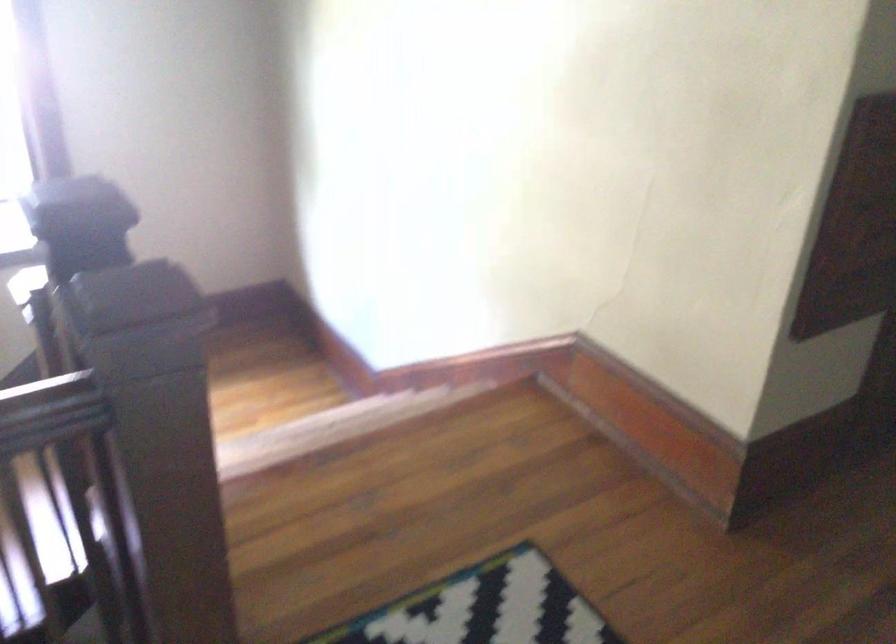
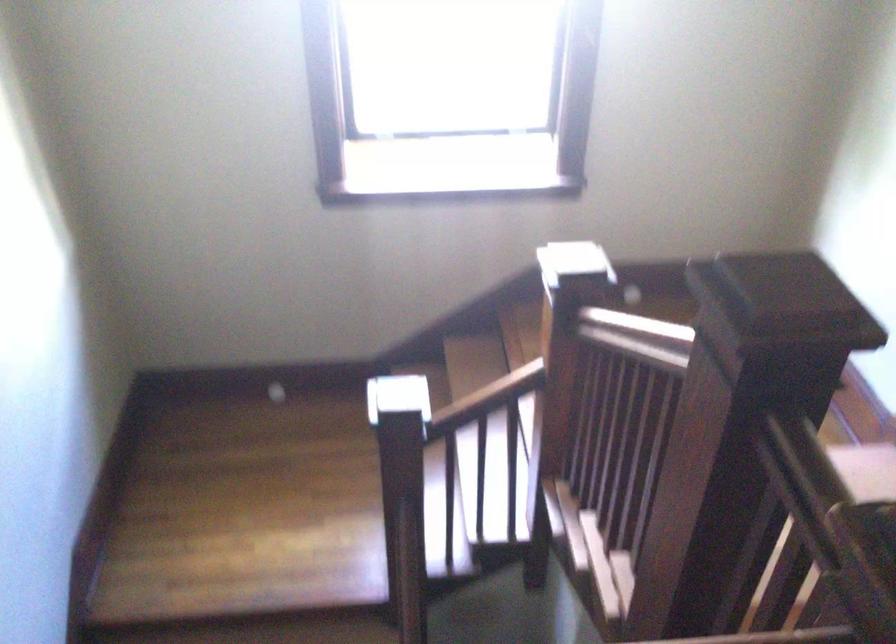
What movement of the cameraman would produce the second image?

The movement direction of the cameraman is left, forward.